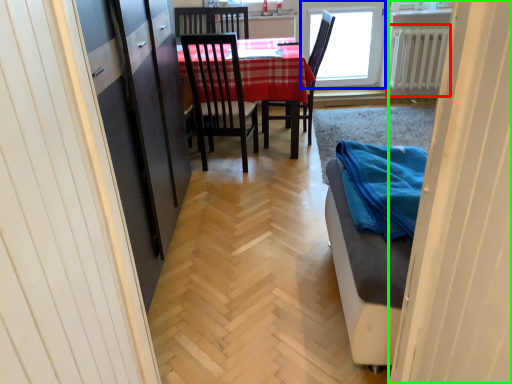
Question: Estimate the real-world distances between objects in this image. Which object is closer to radiator (highlighted by a red box), window (highlighted by a blue box) or door (highlighted by a green box)?

Choices:
 (A) window
 (B) door

Answer: (A)